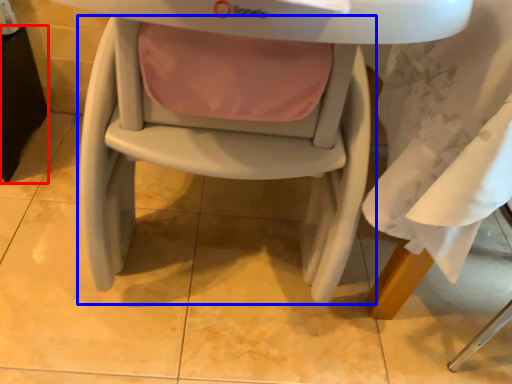
Question: Which of the following is the farthest to the observer, table (highlighted by a red box) or chair (highlighted by a blue box)?

Choices:
 (A) table
 (B) chair

Answer: (A)